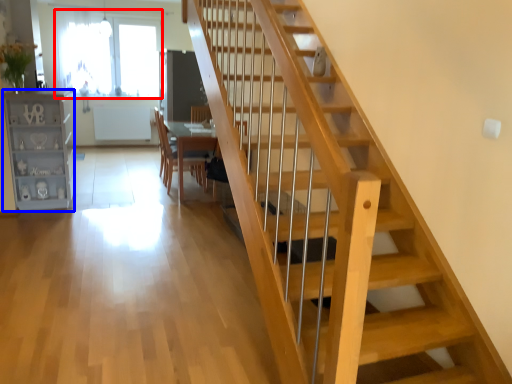
Question: Which object appears farthest to the camera in this image, window (highlighted by a red box) or bookshelf (highlighted by a blue box)?

Choices:
 (A) window
 (B) bookshelf

Answer: (A)